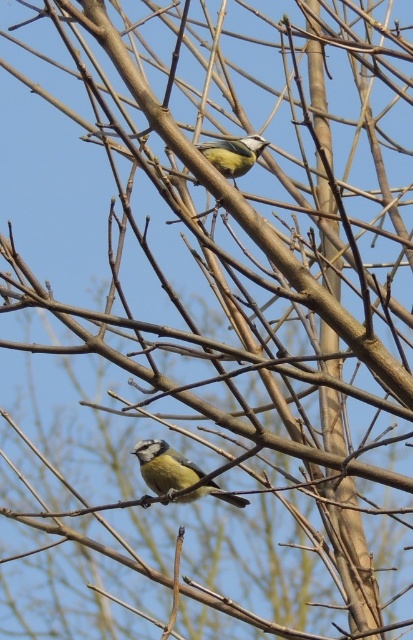
Is blue-green feathers at lower center to the left of blue matte bird at upper center from the viewer's perspective?

Yes, blue-green feathers at lower center is to the left of blue matte bird at upper center.

Does point (197, 492) come behind point (208, 147)?

Yes, point (197, 492) is behind point (208, 147).

This screenshot has width=413, height=640. What are the coordinates of `blue-green feathers at lower center` in the screenshot? It's located at (165, 467).